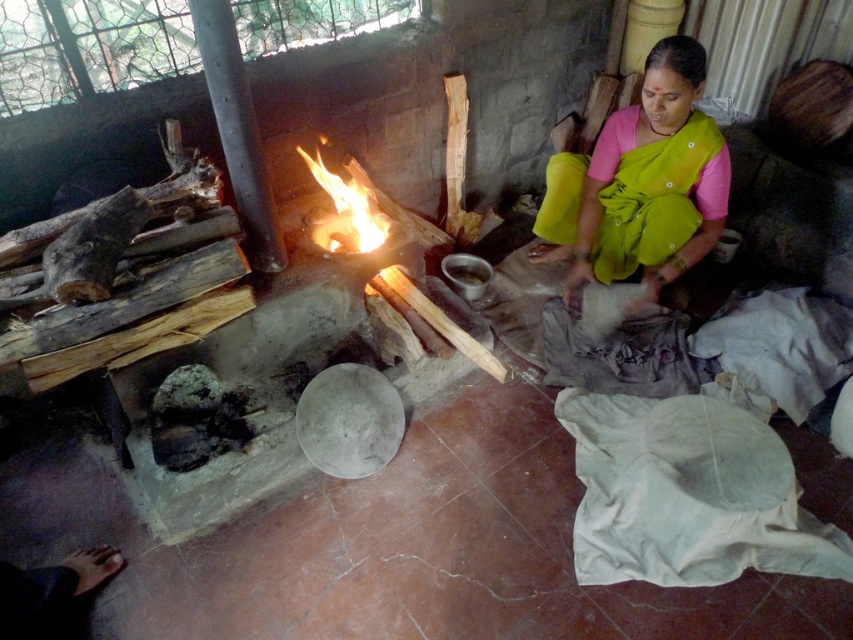
You are a visitor in this home and need to place a small object on the surface directly in front of the woman. Considering the green fabric sari at center and the flamewoodfire at center, which one is taller and thus more likely to block your placement?

The green fabric sari at center is taller than the flamewoodfire at center, so placing the object might be obstructed by the sari.